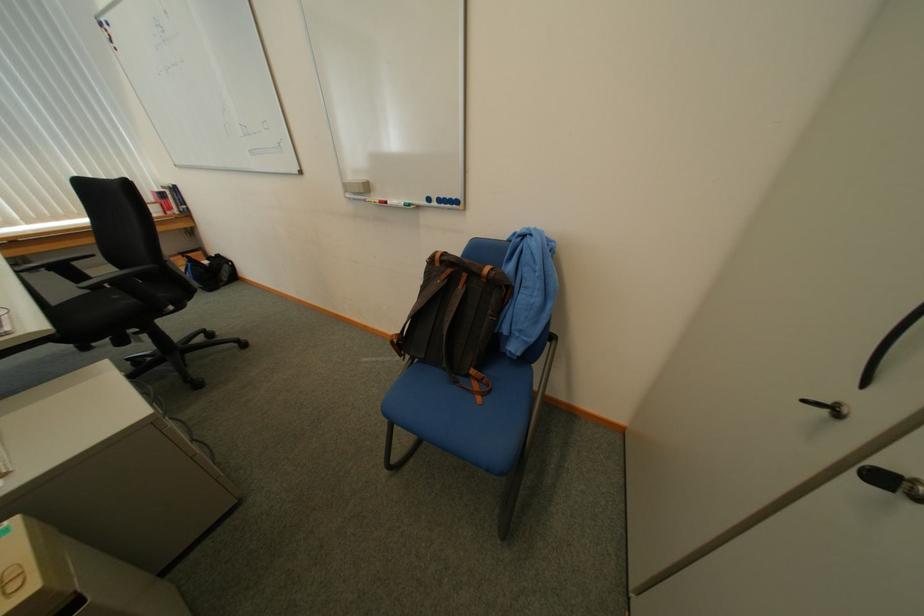
This screenshot has width=924, height=616. I want to click on whiteboard marker, so click(396, 204).